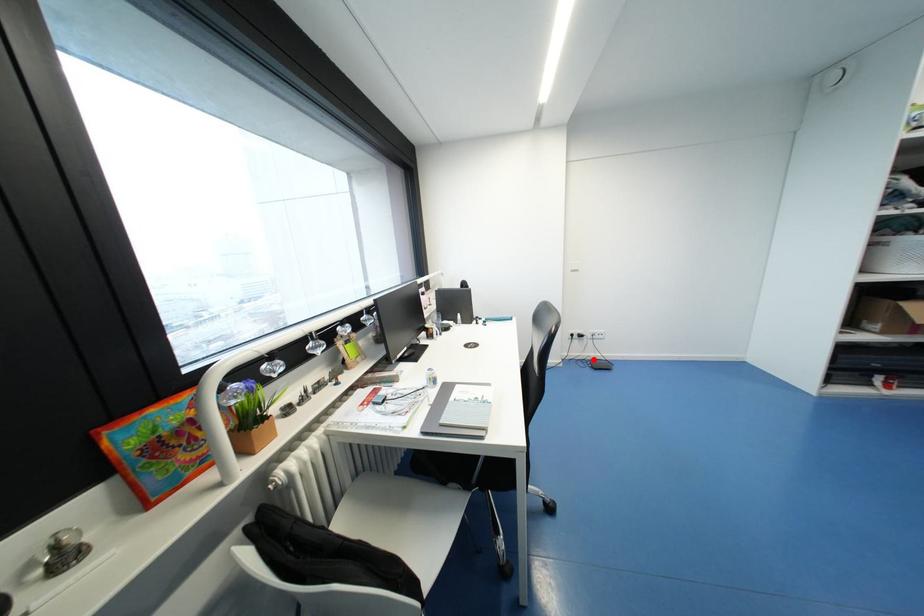
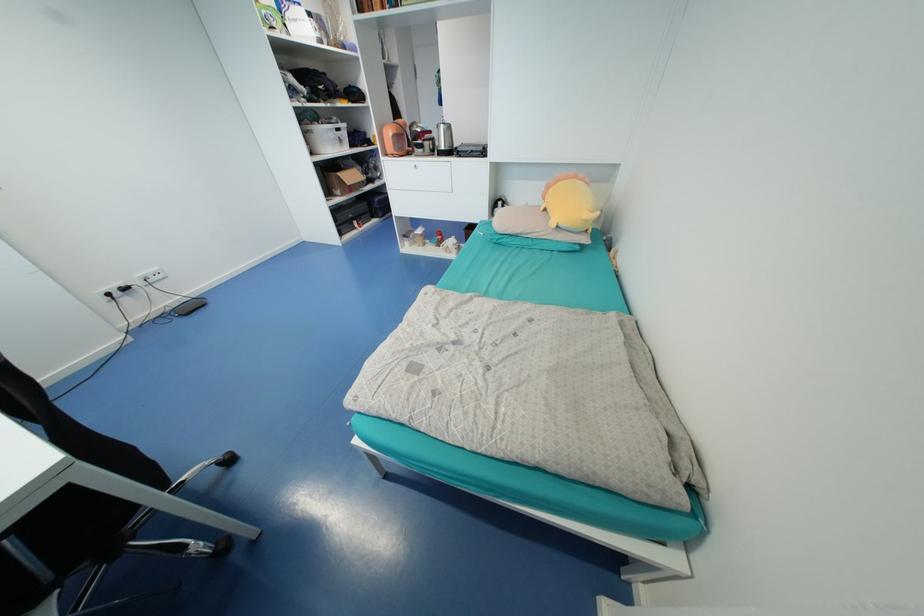
Find the pixel in the second image that matches the highlighted location in the first image.

(174, 310)